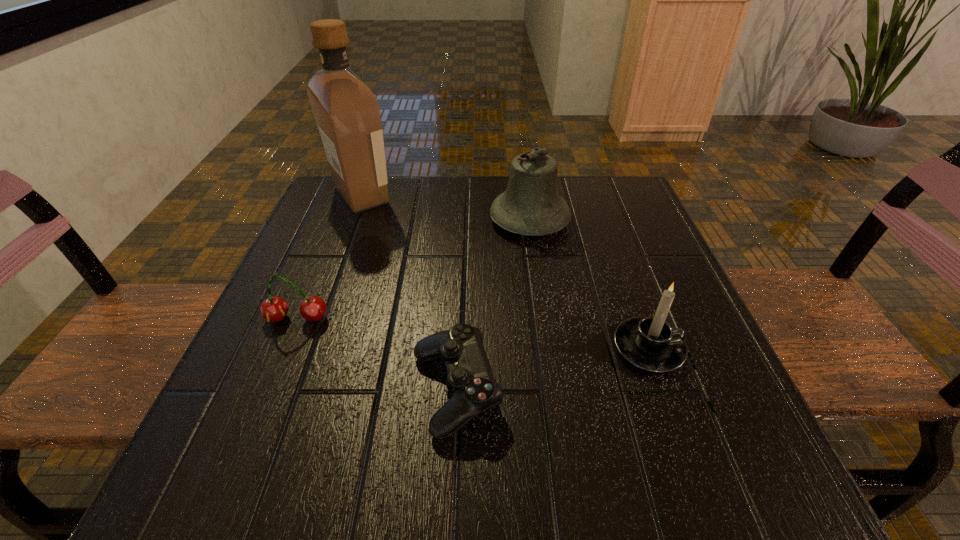
Identify the location of liquor situated at the far edge. (347, 113).

You are a GUI agent. You are given a task and a screenshot of the screen. Output one action in this format:
    pyautogui.click(x=<x>, y=<y>)
    Task: Click on the bell present at the far edge
    
    Given the screenshot: What is the action you would take?
    pyautogui.click(x=531, y=205)

This screenshot has height=540, width=960. Find the location of `object present at the near edge`. object present at the near edge is located at coordinates (470, 380).

The width and height of the screenshot is (960, 540). I want to click on liquor positioned at the left edge, so click(347, 113).

Identify the location of cherry located at the left edge. (313, 308).

Locate an element on the screen. The height and width of the screenshot is (540, 960). object that is at the right edge is located at coordinates (649, 343).

Where is `object that is at the far left corner`? The width and height of the screenshot is (960, 540). object that is at the far left corner is located at coordinates (347, 113).

In the image, there is a desktop. Where is `vacant region at the far edge`? The width and height of the screenshot is (960, 540). vacant region at the far edge is located at coordinates (442, 177).

In the image, there is a desktop. Identify the location of vacant area at the near edge. The width and height of the screenshot is (960, 540). (500, 463).

At what (x,y) coordinates should I click in order to perform the action: click on vacant space at the left edge of the desktop. Please return your answer as a coordinate pair (x, y). This screenshot has width=960, height=540. Looking at the image, I should click on (332, 326).